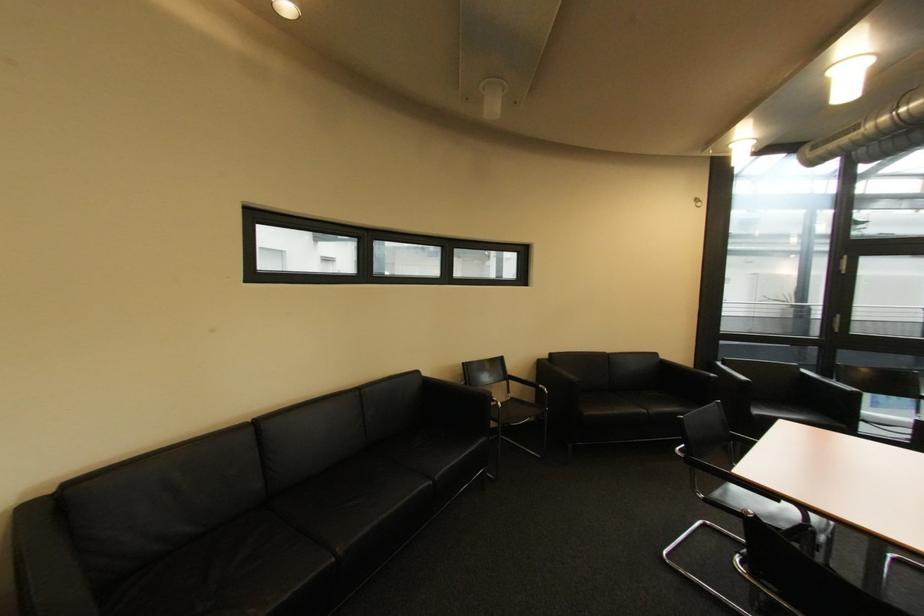
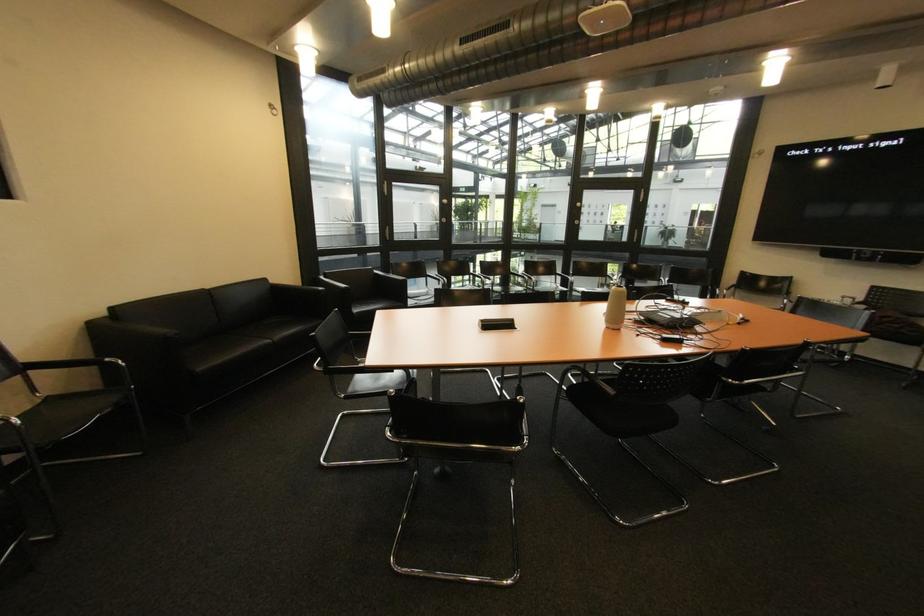
Question: The images are taken continuously from a first-person perspective. In which direction is your viewpoint rotating?

Choices:
 (A) Left
 (B) Right
 (C) Up
 (D) Down

Answer: (B)